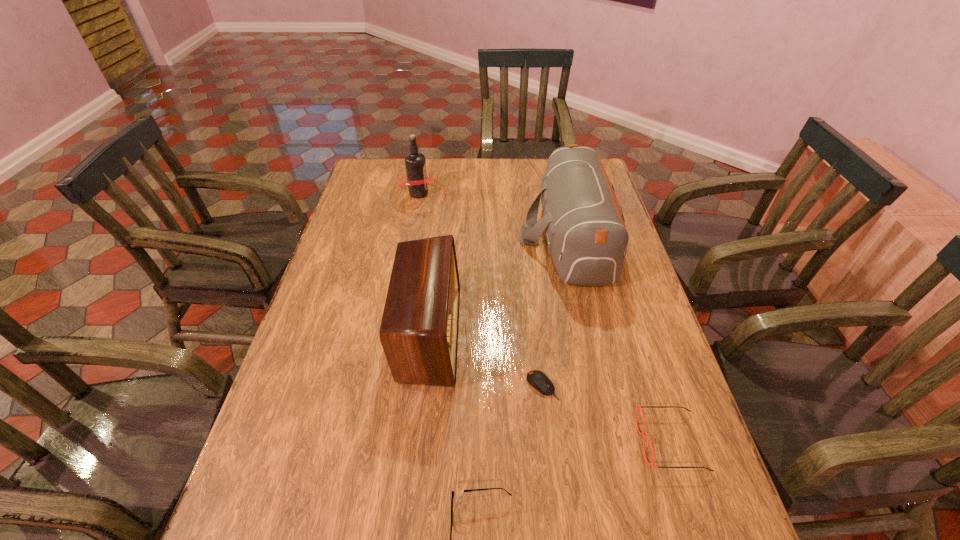
The image size is (960, 540). I want to click on root beer, so click(417, 181).

The height and width of the screenshot is (540, 960). Identify the location of duffel bag. (587, 239).

In order to click on radio receiver in this screenshot , I will do `click(419, 328)`.

What are the coordinates of `the right spectacles` in the screenshot? It's located at (637, 408).

Identify the location of the farther spectacles. The width and height of the screenshot is (960, 540). (637, 408).

You are a GUI agent. You are given a task and a screenshot of the screen. Output one action in this format:
    pyautogui.click(x=<x>, y=<y>)
    Task: Click on the shortest object
    The width and height of the screenshot is (960, 540).
    Given the screenshot: What is the action you would take?
    point(537,379)

What are the coordinates of `vacant area situated on the label of the root beer` in the screenshot? It's located at (523, 193).

Where is `free space located 0.250m on the front of the duffel bag`? free space located 0.250m on the front of the duffel bag is located at coordinates (600, 369).

The image size is (960, 540). I want to click on free location located 0.180m on the front-facing side of the radio receiver, so point(527,333).

Locate an element on the screen. The width and height of the screenshot is (960, 540). free location located on the front-facing side of the second nearest object is located at coordinates (608, 442).